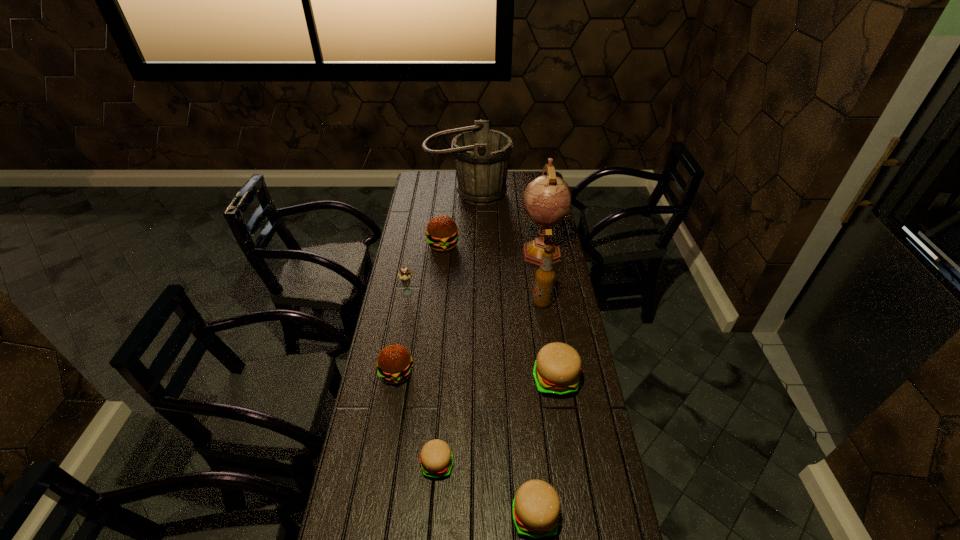
The height and width of the screenshot is (540, 960). I want to click on globe, so click(546, 200).

You are a GUI agent. You are given a task and a screenshot of the screen. Output one action in this format:
    pyautogui.click(x=<x>, y=<y>)
    Task: Click on the tallest object
    
    Given the screenshot: What is the action you would take?
    coord(546,200)

Image resolution: width=960 pixels, height=540 pixels. In order to click on bucket in this screenshot , I will do pos(481,155).

At what (x,y) coordinates should I click in order to perform the action: click on the farthest object. Please return your answer as a coordinate pair (x, y). Looking at the image, I should click on (481, 155).

This screenshot has width=960, height=540. What are the coordinates of `the seventh shortest object` in the screenshot? It's located at (545, 276).

What are the coordinates of `icecream` in the screenshot? It's located at (404, 275).

This screenshot has width=960, height=540. Identify the location of the farthest hamburger. (442, 235).

Identify the location of the farther brown hamburger. (442, 235).

Locate an element on the screen. This screenshot has width=960, height=540. the biggest beige hamburger is located at coordinates (557, 368).

Find the location of a particular element. the smaller brown hamburger is located at coordinates (394, 362).